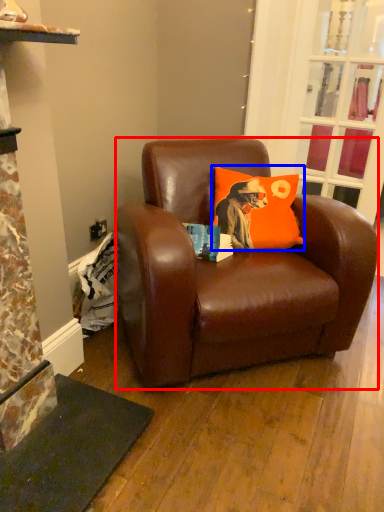
Question: Which object is closer to the camera taking this photo, studio couch (highlighted by a red box) or pillow (highlighted by a blue box)?

Choices:
 (A) studio couch
 (B) pillow

Answer: (A)